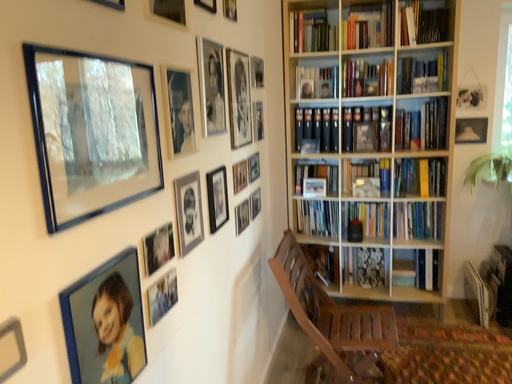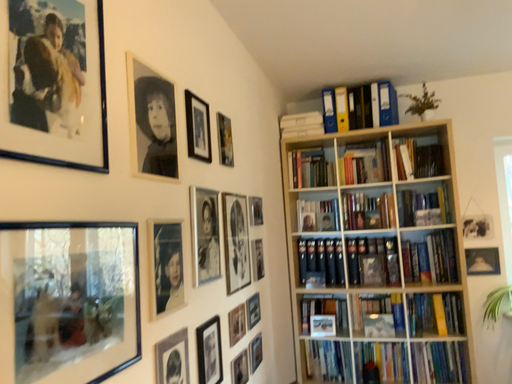
Question: Which way did the camera rotate in the video?

Choices:
 (A) rotated upward
 (B) rotated downward

Answer: (A)